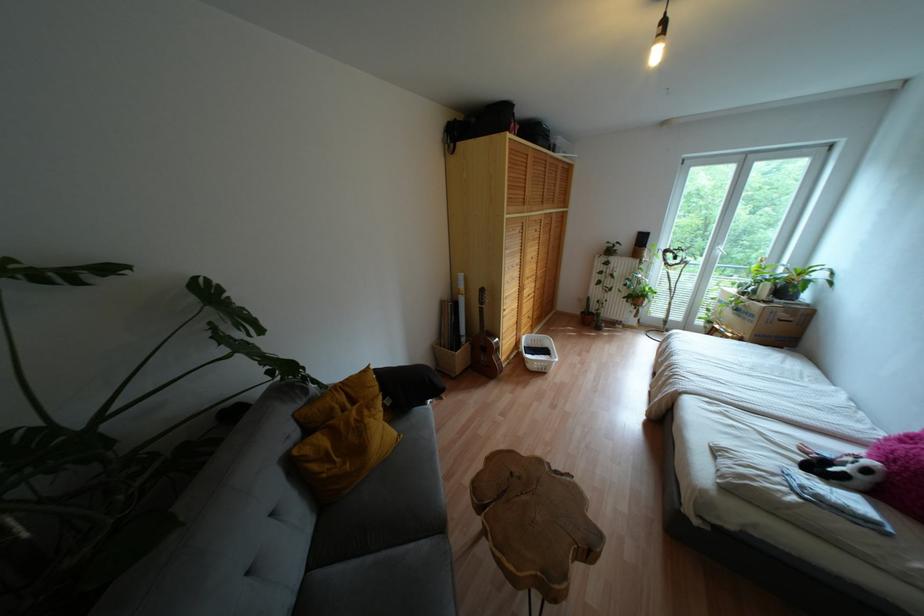
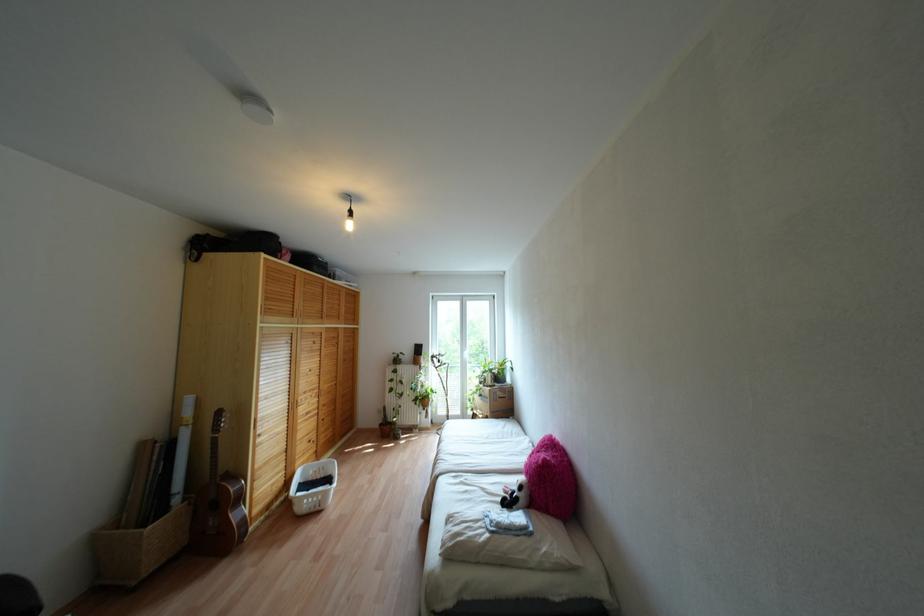
Where in the second image is the point corresponding to (528,294) from the first image?

(307, 413)